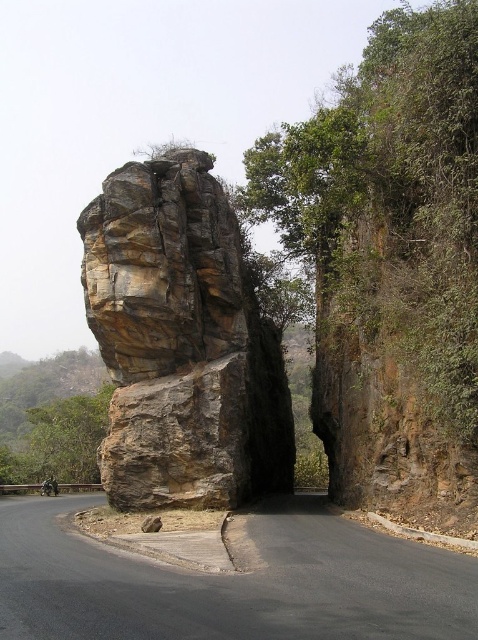
Question: Among these points, which one is nearest to the camera?

Choices:
 (A) (359, 596)
 (B) (285, 445)
 (C) (60, 448)

Answer: (A)

Question: Considering the real-world distances, which object is farthest from the green leafy tree at left?

Choices:
 (A) rustic stone rock at center
 (B) asphalt road at center

Answer: (B)

Question: Which point appears closest to the camera in this image?

Choices:
 (A) (471, 618)
 (B) (68, 465)
 (C) (145, 483)

Answer: (A)

Question: Can you confirm if rustic stone rock at center is positioned to the left of green leafy tree at left?

Choices:
 (A) yes
 (B) no

Answer: (B)

Question: Is asphalt road at center positioned in front of green leafy tree at left?

Choices:
 (A) yes
 (B) no

Answer: (A)

Question: Is asphalt road at center to the left of green leafy tree at left from the viewer's perspective?

Choices:
 (A) yes
 (B) no

Answer: (B)